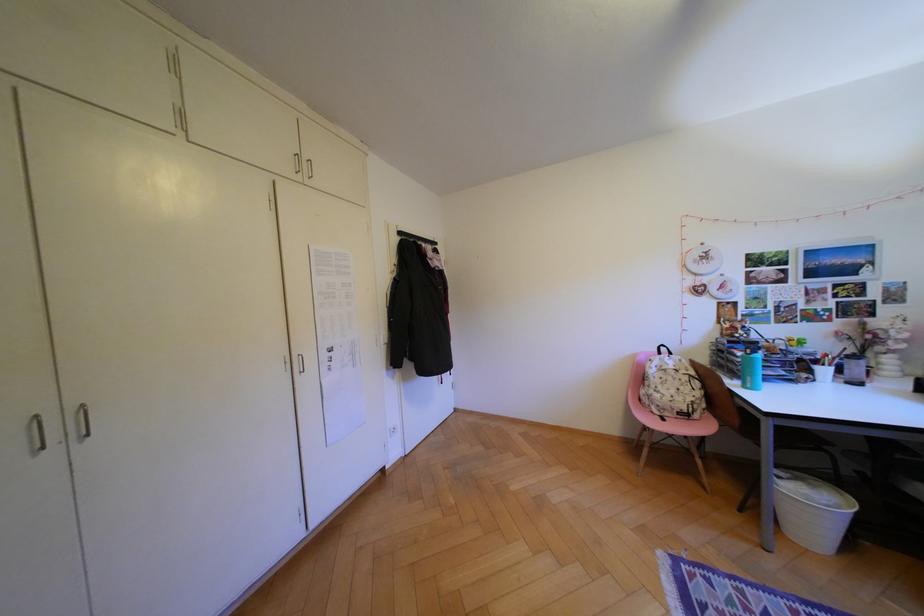
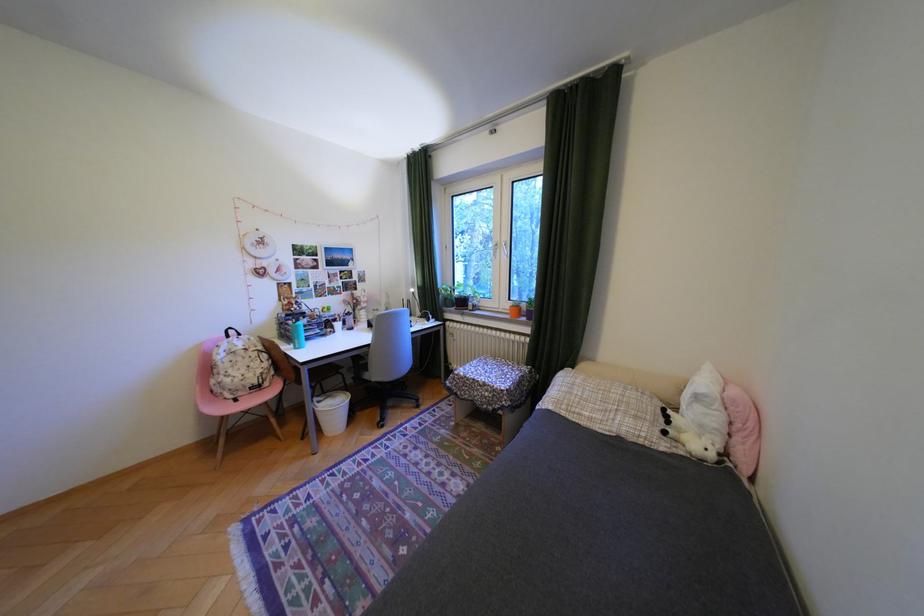
Where in the second image is the point corresponding to (745,363) from the first image?

(300, 331)